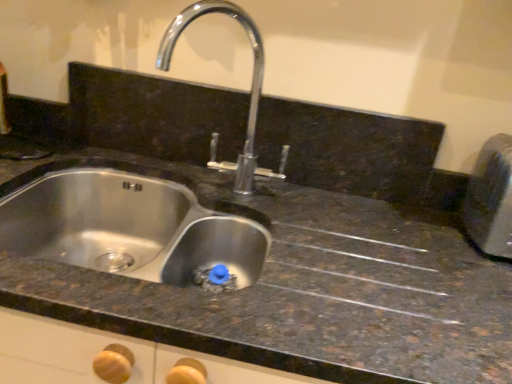
Question: Is metallic silver toaster at right smaller than stainless steel sink at center?

Choices:
 (A) no
 (B) yes

Answer: (B)

Question: Is metallic silver toaster at right looking in the opposite direction of stainless steel sink at center?

Choices:
 (A) yes
 (B) no

Answer: (B)

Question: Can you confirm if metallic silver toaster at right is wider than stainless steel sink at center?

Choices:
 (A) yes
 (B) no

Answer: (B)

Question: From a real-world perspective, does metallic silver toaster at right stand above stainless steel sink at center?

Choices:
 (A) no
 (B) yes

Answer: (B)

Question: Is metallic silver toaster at right further to the viewer compared to stainless steel sink at center?

Choices:
 (A) no
 (B) yes

Answer: (B)

Question: Considering their positions, is stainless steel sink at center located in front of or behind polished chrome tap at center?

Choices:
 (A) front
 (B) behind

Answer: (A)

Question: From the image's perspective, is stainless steel sink at center above or below polished chrome tap at center?

Choices:
 (A) above
 (B) below

Answer: (B)

Question: Based on their positions, is stainless steel sink at center located to the left or right of polished chrome tap at center?

Choices:
 (A) right
 (B) left

Answer: (B)

Question: In terms of width, does stainless steel sink at center look wider or thinner when compared to polished chrome tap at center?

Choices:
 (A) thin
 (B) wide

Answer: (B)

Question: Based on their sizes in the image, would you say metallic silver toaster at right is bigger or smaller than stainless steel sink at center?

Choices:
 (A) big
 (B) small

Answer: (B)

Question: From a real-world perspective, is metallic silver toaster at right above or below stainless steel sink at center?

Choices:
 (A) below
 (B) above

Answer: (B)

Question: Is metallic silver toaster at right taller or shorter than stainless steel sink at center?

Choices:
 (A) tall
 (B) short

Answer: (B)

Question: Is metallic silver toaster at right inside the boundaries of stainless steel sink at center, or outside?

Choices:
 (A) outside
 (B) inside

Answer: (A)

Question: In terms of size, does polished chrome tap at center appear bigger or smaller than metallic silver toaster at right?

Choices:
 (A) small
 (B) big

Answer: (B)

Question: From the image's perspective, is polished chrome tap at center positioned above or below metallic silver toaster at right?

Choices:
 (A) below
 (B) above

Answer: (B)